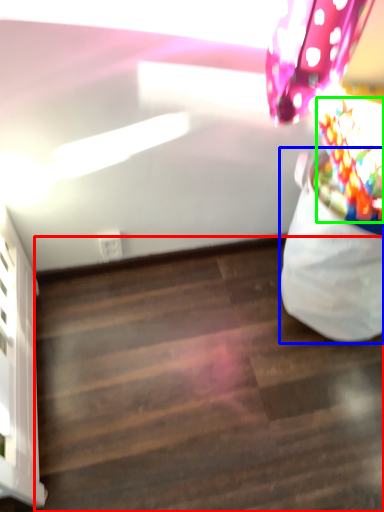
Question: Estimate the real-world distances between objects in this image. Which object is farther from stairwell (highlighted by a red box), bean bag chair (highlighted by a blue box) or flower (highlighted by a green box)?

Choices:
 (A) bean bag chair
 (B) flower

Answer: (B)